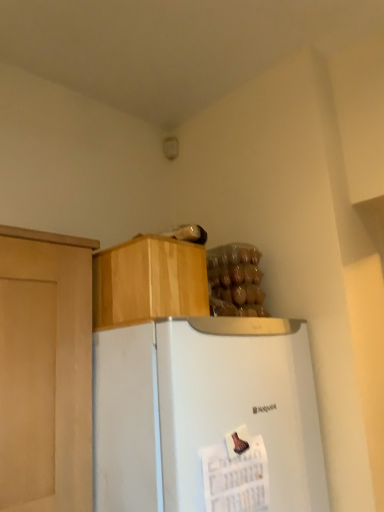
What do you see at coordinates (235, 281) in the screenshot? This screenshot has width=384, height=512. I see `translucent plastic bag of food at upper right` at bounding box center [235, 281].

Find the location of a particular element. The image size is (384, 512). white matte refrigerator at center is located at coordinates (202, 411).

Choose the correct answer: Is translucent plastic bag of food at upper right inside wooden cabinet at upper center or outside it?

translucent plastic bag of food at upper right is spatially situated outside wooden cabinet at upper center.

Are translucent plastic bag of food at upper right and wooden cabinet at upper center making contact?

translucent plastic bag of food at upper right and wooden cabinet at upper center are clearly separated.

Is point (248, 260) positioned before point (128, 268)?

No, it is not.

Is wooden cabinet at upper center in front of or behind white matte refrigerator at center in the image?

Clearly, wooden cabinet at upper center is behind white matte refrigerator at center.

From the picture: Can you confirm if wooden cabinet at upper center is taller than white matte refrigerator at center?

In fact, wooden cabinet at upper center may be shorter than white matte refrigerator at center.

Who is bigger, wooden cabinet at upper center or white matte refrigerator at center?

white matte refrigerator at center.

Based on the photo, from a real-world perspective, is wooden cabinet at upper center positioned above or below translucent plastic bag of food at upper right?

wooden cabinet at upper center is situated lower than translucent plastic bag of food at upper right in the real world.

Can you confirm if wooden cabinet at upper center is smaller than translucent plastic bag of food at upper right?

Incorrect, wooden cabinet at upper center is not smaller in size than translucent plastic bag of food at upper right.

Would you say wooden cabinet at upper center is a long distance from translucent plastic bag of food at upper right?

wooden cabinet at upper center is actually quite close to translucent plastic bag of food at upper right.

Is translucent plastic bag of food at upper right a part of wooden cabinet at upper center?

Definitely not — translucent plastic bag of food at upper right is not inside wooden cabinet at upper center.

Is point (152, 381) positioned behind point (243, 254)?

No, it is not.

From the image's perspective, who appears lower, white matte refrigerator at center or translucent plastic bag of food at upper right?

white matte refrigerator at center is shown below in the image.

Does white matte refrigerator at center come behind translucent plastic bag of food at upper right?

No.

Based on the photo, considering the relative positions of white matte refrigerator at center and translucent plastic bag of food at upper right in the image provided, is white matte refrigerator at center to the right of translucent plastic bag of food at upper right from the viewer's perspective?

In fact, white matte refrigerator at center is to the left of translucent plastic bag of food at upper right.

In the scene shown: Can you tell me how much white matte refrigerator at center and wooden cabinet at upper center differ in facing direction?

They differ by 0.000699 degrees in their facing directions.

Who is bigger, white matte refrigerator at center or wooden cabinet at upper center?

Bigger between the two is white matte refrigerator at center.

Considering the positions of point (161, 343) and point (144, 275), is point (161, 343) closer or farther from the camera than point (144, 275)?

Point (161, 343) is positioned closer to the camera compared to point (144, 275).

Who is more distant, translucent plastic bag of food at upper right or white matte refrigerator at center?

translucent plastic bag of food at upper right is further from the camera.

Which of these two, translucent plastic bag of food at upper right or white matte refrigerator at center, is smaller?

translucent plastic bag of food at upper right is smaller.

From the image's perspective, who appears lower, translucent plastic bag of food at upper right or white matte refrigerator at center?

white matte refrigerator at center appears lower in the image.

Is point (221, 309) positioned in front of point (191, 483)?

No, (221, 309) is further to viewer.

Identify the location of cabinetry that is on the left side of translucent plastic bag of food at upper right. The height and width of the screenshot is (512, 384). (149, 281).

Image resolution: width=384 pixels, height=512 pixels. In order to click on refrigerator below the wooden cabinet at upper center (from the image's perspective) in this screenshot , I will do click(202, 411).

From the image, which object appears to be nearer to translucent plastic bag of food at upper right, white matte refrigerator at center or wooden cabinet at upper center?

Among the two, wooden cabinet at upper center is located nearer to translucent plastic bag of food at upper right.

Estimate the real-world distances between objects in this image. Which object is closer to translucent plastic bag of food at upper right, wooden cabinet at upper center or white matte refrigerator at center?

wooden cabinet at upper center.

Looking at the image, which one is located closer to wooden cabinet at upper center, white matte refrigerator at center or translucent plastic bag of food at upper right?

Based on the image, white matte refrigerator at center appears to be nearer to wooden cabinet at upper center.

Based on their spatial positions, is translucent plastic bag of food at upper right or white matte refrigerator at center further from wooden cabinet at upper center?

translucent plastic bag of food at upper right lies further to wooden cabinet at upper center than the other object.

When comparing their distances from white matte refrigerator at center, does translucent plastic bag of food at upper right or wooden cabinet at upper center seem closer?

Based on the image, wooden cabinet at upper center appears to be nearer to white matte refrigerator at center.

Which object lies nearer to the anchor point white matte refrigerator at center, wooden cabinet at upper center or translucent plastic bag of food at upper right?

wooden cabinet at upper center lies closer to white matte refrigerator at center than the other object.

I want to click on cabinetry positioned between white matte refrigerator at center and translucent plastic bag of food at upper right from near to far, so click(x=149, y=281).